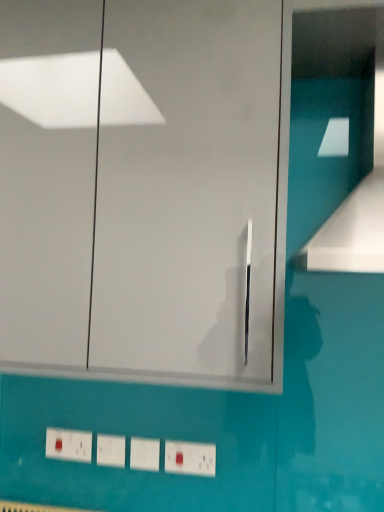
Question: Would you say matte white electric outlet at lower left is outside white plastic light switch at lower center?

Choices:
 (A) no
 (B) yes

Answer: (B)

Question: Can you confirm if matte white electric outlet at lower left is positioned to the left of white plastic light switch at lower center?

Choices:
 (A) no
 (B) yes

Answer: (B)

Question: Does matte white electric outlet at lower left have a lesser height compared to white plastic light switch at lower center?

Choices:
 (A) no
 (B) yes

Answer: (A)

Question: Is matte white electric outlet at lower left oriented away from white plastic light switch at lower center?

Choices:
 (A) no
 (B) yes

Answer: (A)

Question: Is matte white electric outlet at lower left aimed at white plastic light switch at lower center?

Choices:
 (A) no
 (B) yes

Answer: (A)

Question: In terms of width, does white plastic light switch at lower center look wider or thinner when compared to white glossy vent at upper right?

Choices:
 (A) wide
 (B) thin

Answer: (B)

Question: From the image's perspective, is white plastic light switch at lower center above or below white glossy vent at upper right?

Choices:
 (A) above
 (B) below

Answer: (B)

Question: Relative to white glossy vent at upper right, is white plastic light switch at lower center in front or behind?

Choices:
 (A) front
 (B) behind

Answer: (B)

Question: Is point (114, 457) closer or farther from the camera than point (375, 22)?

Choices:
 (A) farther
 (B) closer

Answer: (A)

Question: From a real-world perspective, is white glossy vent at upper right physically located above or below matte white electric outlet at lower left?

Choices:
 (A) above
 (B) below

Answer: (A)

Question: Which is correct: white glossy vent at upper right is inside matte white electric outlet at lower left, or outside of it?

Choices:
 (A) inside
 (B) outside

Answer: (B)

Question: Based on their sizes in the image, would you say white glossy vent at upper right is bigger or smaller than matte white electric outlet at lower left?

Choices:
 (A) big
 (B) small

Answer: (A)

Question: Does point (349, 242) appear closer or farther from the camera than point (51, 438)?

Choices:
 (A) closer
 (B) farther

Answer: (A)

Question: Considering their positions, is matte white electric outlet at lower left located in front of or behind transparent glass door at center?

Choices:
 (A) behind
 (B) front

Answer: (A)

Question: Considering the positions of point (66, 433) and point (233, 203), is point (66, 433) closer or farther from the camera than point (233, 203)?

Choices:
 (A) farther
 (B) closer

Answer: (A)